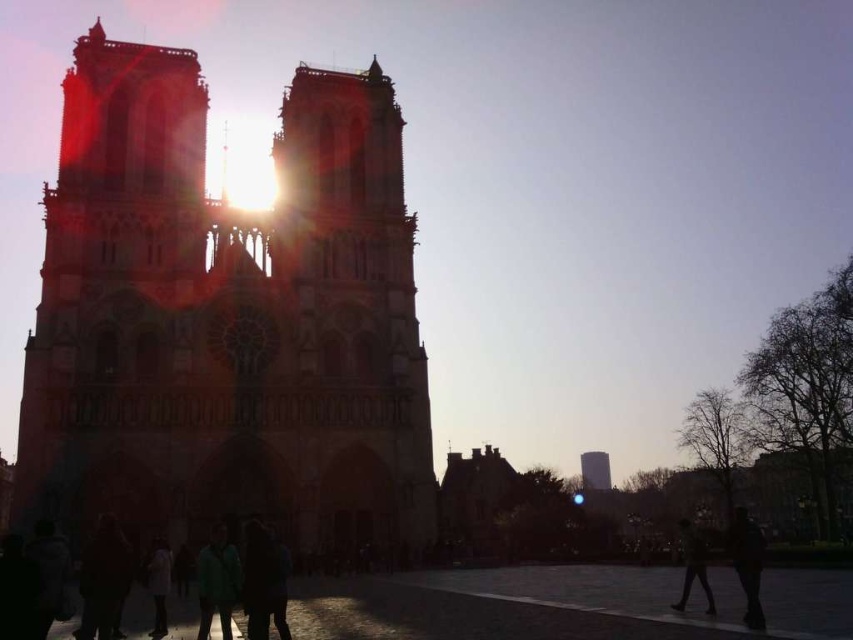
Based on the photo, you are standing in front of the Notre Dame Cathedral and want to take a photo. You notice two points on the cathedral facade labeled as point 1 at coordinates point [97,26] and point 2 at coordinates point [161,625]. Which point is closer to your camera?

Point [97,26] is further to the camera than point [161,625], so point [161,625] is closer to the camera.

Based on the photo, you are a tourist standing in front of Notre Dame Cathedral. You see a silhouette figure at lower right and a smooth concrete tower at center. Which object is taller?

The silhouette figure at lower right is much taller than the smooth concrete tower at center.